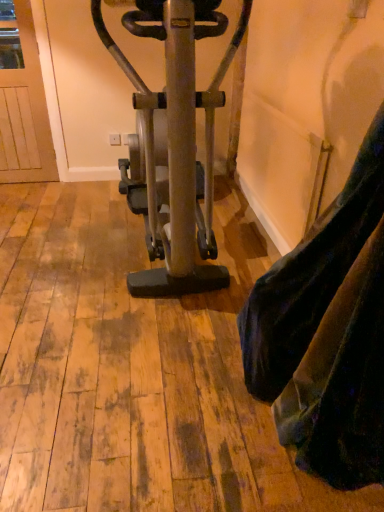
Question: Is metallic gold stationary bicycle at center to the left or to the right of velvet-like fabric at lower right in the image?

Choices:
 (A) right
 (B) left

Answer: (B)

Question: Considering the positions of metallic gold stationary bicycle at center and velvet-like fabric at lower right in the image, is metallic gold stationary bicycle at center taller or shorter than velvet-like fabric at lower right?

Choices:
 (A) short
 (B) tall

Answer: (B)

Question: From the image's perspective, is metallic gold stationary bicycle at center above or below velvet-like fabric at lower right?

Choices:
 (A) above
 (B) below

Answer: (A)

Question: Is velvet-like fabric at lower right wider or thinner than metallic gold stationary bicycle at center?

Choices:
 (A) wide
 (B) thin

Answer: (B)

Question: Based on their positions, is velvet-like fabric at lower right located to the left or right of metallic gold stationary bicycle at center?

Choices:
 (A) left
 (B) right

Answer: (B)

Question: Is velvet-like fabric at lower right bigger or smaller than metallic gold stationary bicycle at center?

Choices:
 (A) small
 (B) big

Answer: (A)

Question: From the image's perspective, is velvet-like fabric at lower right above or below metallic gold stationary bicycle at center?

Choices:
 (A) above
 (B) below

Answer: (B)